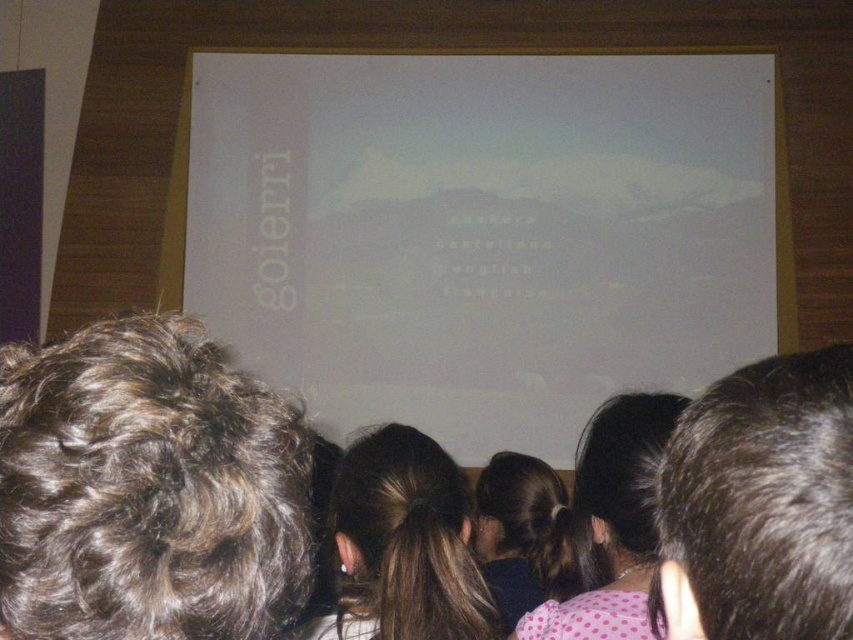
You are sitting in the audience facing the white matte projection screen at center. You notice someone with dark curly hair at upper left in your line of sight. Can you see their face clearly?

The dark curly hair at upper left is behind the white matte projection screen at center, so you cannot see their face clearly because they are obscured by the screen.

You are an attendee at the presentation and want to take a photo of the slide. The white matte projection screen at center and dark brown hair at upper right are both in your camera frame. Which object will appear larger in your photo?

The white matte projection screen at center will appear larger in your photo because it is much taller than the dark brown hair at upper right.